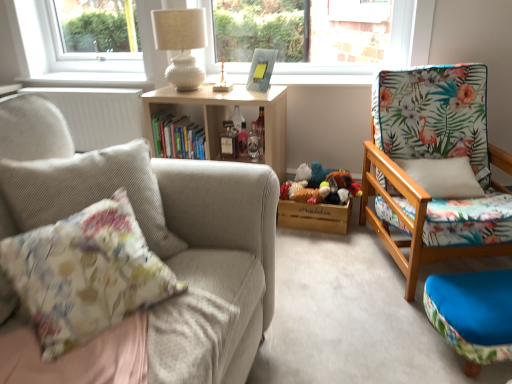
Question: Can you confirm if clear glass bottle at center, which is the 3th bottle in left-to-right order, is positioned to the left of blue fabric ottoman at lower right?

Choices:
 (A) yes
 (B) no

Answer: (A)

Question: From the image's perspective, is clear glass bottle at center, which is the 3th bottle in left-to-right order, below blue fabric ottoman at lower right?

Choices:
 (A) no
 (B) yes

Answer: (A)

Question: Is clear glass bottle at center, which appears as the first bottle when viewed from the right, positioned beyond the bounds of blue fabric ottoman at lower right?

Choices:
 (A) no
 (B) yes

Answer: (B)

Question: From the image's perspective, is clear glass bottle at center, which is the 3th bottle in left-to-right order, over blue fabric ottoman at lower right?

Choices:
 (A) no
 (B) yes

Answer: (B)

Question: Is clear glass bottle at center, which appears as the first bottle when viewed from the right, positioned before blue fabric ottoman at lower right?

Choices:
 (A) no
 (B) yes

Answer: (A)

Question: Choose the correct answer: Is clear glass bottle at center, which is the 3th bottle in left-to-right order, inside floral fabric cushion at left or outside it?

Choices:
 (A) outside
 (B) inside

Answer: (A)

Question: Is clear glass bottle at center, which is the 3th bottle in left-to-right order, to the left or to the right of floral fabric cushion at left in the image?

Choices:
 (A) right
 (B) left

Answer: (A)

Question: From their relative heights in the image, would you say clear glass bottle at center, which appears as the first bottle when viewed from the right, is taller or shorter than floral fabric cushion at left?

Choices:
 (A) short
 (B) tall

Answer: (A)

Question: Is point (260, 145) positioned closer to the camera than point (121, 301)?

Choices:
 (A) closer
 (B) farther

Answer: (B)

Question: Would you say floral fabric cushion at left is to the left or to the right of floral fabric chair at right, placed as the 1th chair when sorted from right to left, in the picture?

Choices:
 (A) right
 (B) left

Answer: (B)

Question: From the image's perspective, is floral fabric cushion at left located above or below floral fabric chair at right, which is the 1th chair from back to front?

Choices:
 (A) below
 (B) above

Answer: (A)

Question: In terms of width, does floral fabric cushion at left look wider or thinner when compared to floral fabric chair at right, which ranks as the 2th chair in left-to-right order?

Choices:
 (A) thin
 (B) wide

Answer: (A)

Question: Is floral fabric cushion at left in front of or behind floral fabric chair at right, which ranks as the 2th chair in left-to-right order, in the image?

Choices:
 (A) front
 (B) behind

Answer: (A)

Question: Is point (193, 132) closer or farther from the camera than point (254, 137)?

Choices:
 (A) farther
 (B) closer

Answer: (B)

Question: Which is correct: hardcover books at center is inside clear glass bottle at center, which appears as the first bottle when viewed from the right, or outside of it?

Choices:
 (A) inside
 (B) outside

Answer: (B)